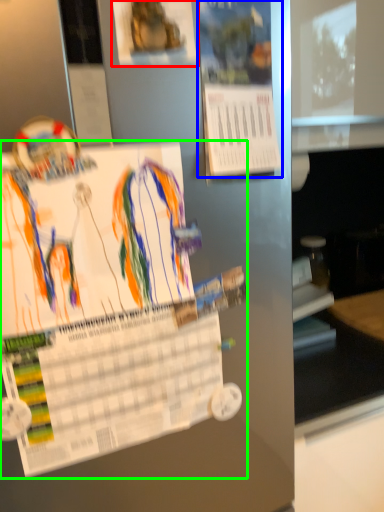
Question: Which object is positioned farthest from poster (highlighted by a red box)? Select from poster (highlighted by a blue box) and poster (highlighted by a green box).

Choices:
 (A) poster
 (B) poster

Answer: (B)